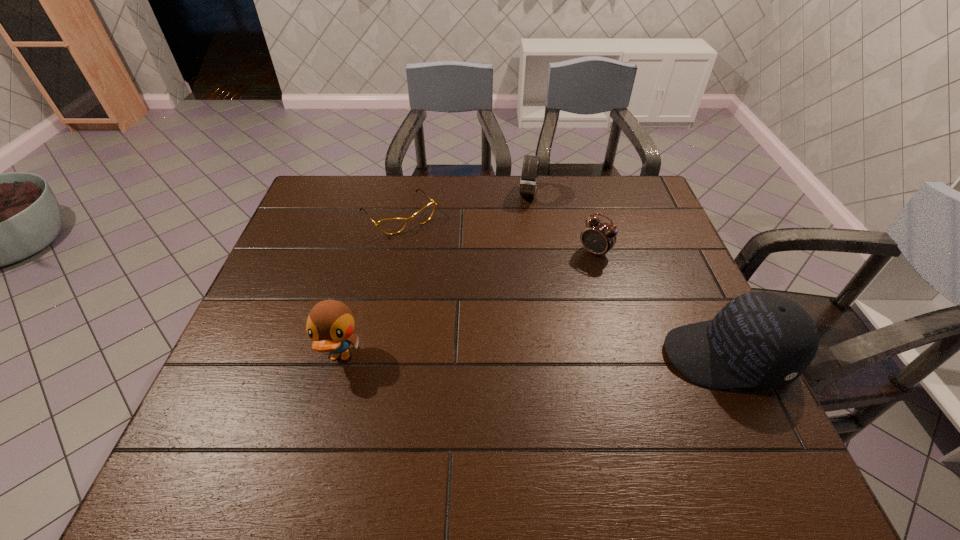
Locate an element on the screen. The width and height of the screenshot is (960, 540). duck is located at coordinates (330, 324).

This screenshot has height=540, width=960. Identify the location of the rightmost object. (759, 339).

At what (x,y) coordinates should I click in order to perform the action: click on spectacles. Please return your answer as a coordinate pair (x, y). The height and width of the screenshot is (540, 960). Looking at the image, I should click on (392, 225).

The width and height of the screenshot is (960, 540). In order to click on the third object from right to left in this screenshot , I will do `click(528, 182)`.

Where is `the third farthest object`? The image size is (960, 540). the third farthest object is located at coordinates (598, 237).

Identify the location of the second object from right to left. This screenshot has width=960, height=540. (598, 237).

Identify the location of free spot located 0.330m at the front of the rightmost object where the brim is located. (519, 356).

Identify the location of vacant space located 0.400m at the front of the rightmost object where the brim is located. (489, 356).

In order to click on vacant space positioned at the front of the rightmost object where the brim is located in this screenshot , I will do `click(638, 356)`.

Locate an element on the screen. The image size is (960, 540). free region located 0.340m on the front-facing side of the spectacles is located at coordinates (477, 307).